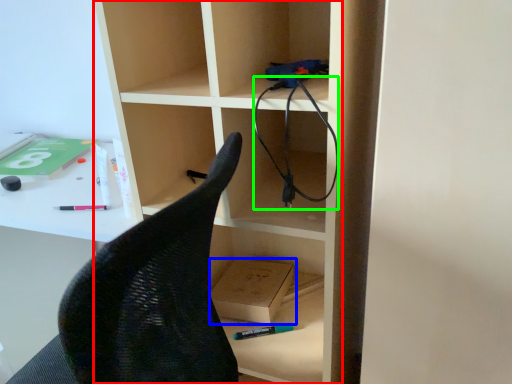
Question: Based on their relative distances, which object is nearer to bookshelf (highlighted by a red box)? Choose from cardboard box (highlighted by a blue box) and cable (highlighted by a green box).

Choices:
 (A) cardboard box
 (B) cable

Answer: (B)